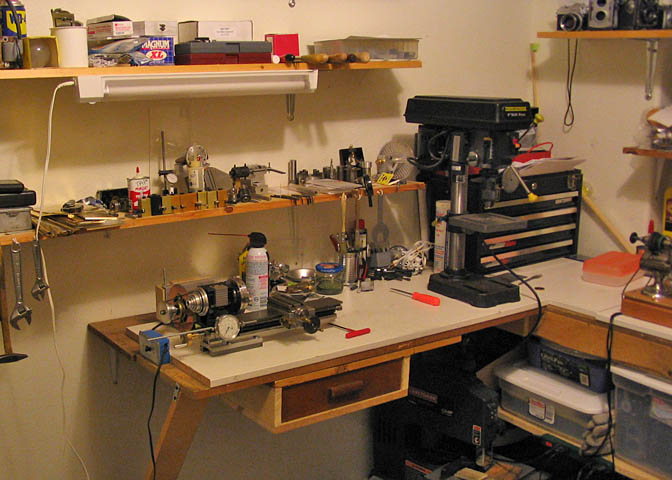
The width and height of the screenshot is (672, 480). Find the location of `drawer`. drawer is located at coordinates (312, 403).